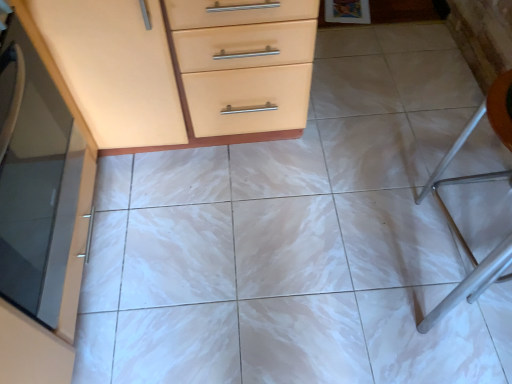
Question: Is matte glass cabinet at left positioned beyond the bounds of matte orange cabinet at upper left, placed as the second chest of drawers when sorted from bottom to top?

Choices:
 (A) yes
 (B) no

Answer: (A)

Question: Is matte glass cabinet at left positioned far away from matte orange cabinet at upper left, placed as the second chest of drawers when sorted from bottom to top?

Choices:
 (A) yes
 (B) no

Answer: (B)

Question: Is matte glass cabinet at left at the left side of matte orange cabinet at upper left, placed as the 1th chest of drawers when sorted from top to bottom?

Choices:
 (A) no
 (B) yes

Answer: (B)

Question: Considering the relative sizes of matte glass cabinet at left and matte orange cabinet at upper left, placed as the second chest of drawers when sorted from bottom to top, in the image provided, is matte glass cabinet at left bigger than matte orange cabinet at upper left, placed as the second chest of drawers when sorted from bottom to top,?

Choices:
 (A) yes
 (B) no

Answer: (B)

Question: Could you tell me if matte glass cabinet at left is facing matte orange cabinet at upper left, placed as the second chest of drawers when sorted from bottom to top?

Choices:
 (A) yes
 (B) no

Answer: (B)

Question: Is matte glass cabinet at left wider than matte orange cabinet at upper left, placed as the second chest of drawers when sorted from bottom to top?

Choices:
 (A) yes
 (B) no

Answer: (B)

Question: Is orange plastic folding chair at right at the back of matte wood chest of drawers at upper left, placed as the 2th chest of drawers when sorted from top to bottom?

Choices:
 (A) yes
 (B) no

Answer: (B)

Question: Does matte wood chest of drawers at upper left, placed as the 2th chest of drawers when sorted from top to bottom, have a larger size compared to orange plastic folding chair at right?

Choices:
 (A) no
 (B) yes

Answer: (B)

Question: From the image's perspective, does matte wood chest of drawers at upper left, placed as the 2th chest of drawers when sorted from top to bottom, appear higher than orange plastic folding chair at right?

Choices:
 (A) yes
 (B) no

Answer: (B)

Question: Is matte wood chest of drawers at upper left, placed as the 2th chest of drawers when sorted from top to bottom, positioned before orange plastic folding chair at right?

Choices:
 (A) yes
 (B) no

Answer: (A)

Question: From the image's perspective, would you say matte wood chest of drawers at upper left, marked as the 1th chest of drawers in a bottom-to-top arrangement, is shown under orange plastic folding chair at right?

Choices:
 (A) no
 (B) yes

Answer: (B)

Question: Considering the relative sizes of matte wood chest of drawers at upper left, placed as the 2th chest of drawers when sorted from top to bottom, and orange plastic folding chair at right in the image provided, is matte wood chest of drawers at upper left, placed as the 2th chest of drawers when sorted from top to bottom, wider than orange plastic folding chair at right?

Choices:
 (A) yes
 (B) no

Answer: (A)

Question: Does orange plastic folding chair at right have a larger size compared to matte glass cabinet at left?

Choices:
 (A) yes
 (B) no

Answer: (A)